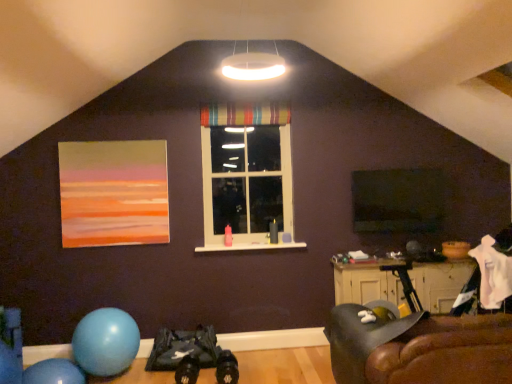
Question: Can you confirm if wooden cabinet at lower right is positioned to the right of leather couch at lower right?

Choices:
 (A) no
 (B) yes

Answer: (B)

Question: Does wooden cabinet at lower right appear on the left side of leather couch at lower right?

Choices:
 (A) yes
 (B) no

Answer: (B)

Question: Does wooden cabinet at lower right have a lesser height compared to leather couch at lower right?

Choices:
 (A) yes
 (B) no

Answer: (A)

Question: Is wooden cabinet at lower right next to leather couch at lower right?

Choices:
 (A) no
 (B) yes

Answer: (A)

Question: Can you confirm if wooden cabinet at lower right is thinner than leather couch at lower right?

Choices:
 (A) no
 (B) yes

Answer: (B)

Question: Is wooden cabinet at lower right far away from leather couch at lower right?

Choices:
 (A) yes
 (B) no

Answer: (B)

Question: From a real-world perspective, is striped fabric curtain at upper center positioned under transparent plastic window screen at center based on gravity?

Choices:
 (A) no
 (B) yes

Answer: (A)

Question: Is striped fabric curtain at upper center at the right side of transparent plastic window screen at center?

Choices:
 (A) no
 (B) yes

Answer: (A)

Question: Does striped fabric curtain at upper center have a lesser width compared to transparent plastic window screen at center?

Choices:
 (A) yes
 (B) no

Answer: (B)

Question: From the image's perspective, is striped fabric curtain at upper center beneath transparent plastic window screen at center?

Choices:
 (A) no
 (B) yes

Answer: (A)

Question: Considering the relative sizes of striped fabric curtain at upper center and transparent plastic window screen at center in the image provided, is striped fabric curtain at upper center wider than transparent plastic window screen at center?

Choices:
 (A) no
 (B) yes

Answer: (B)

Question: Considering the relative positions of striped fabric curtain at upper center and transparent plastic window screen at center in the image provided, is striped fabric curtain at upper center to the left of transparent plastic window screen at center from the viewer's perspective?

Choices:
 (A) yes
 (B) no

Answer: (A)

Question: Is striped fabric curtain at upper center to the left of leather couch at lower right from the viewer's perspective?

Choices:
 (A) no
 (B) yes

Answer: (B)